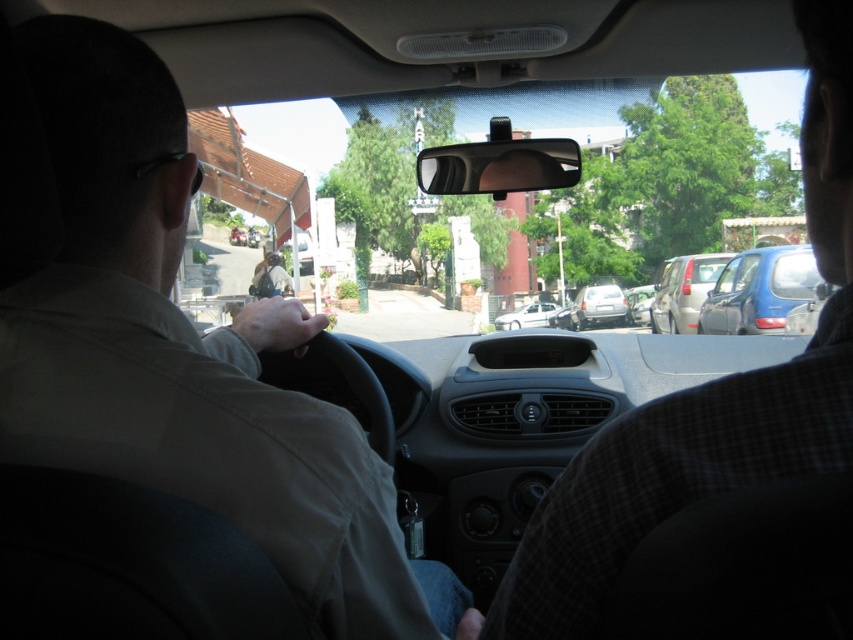
Question: Which point appears closest to the camera in this image?

Choices:
 (A) (799, 278)
 (B) (718, 451)
 (C) (613, 321)

Answer: (B)

Question: Which point is farther to the camera?

Choices:
 (A) silver metallic sedan at right
 (B) checkered fabric shirt at right

Answer: (A)

Question: Which of the following is the farthest from the observer?

Choices:
 (A) (532, 326)
 (B) (604, 308)

Answer: (A)

Question: Can you confirm if checkered fabric shirt at right is positioned to the left of white matte sedan at center?

Choices:
 (A) yes
 (B) no

Answer: (A)

Question: Is light beige shirt at left to the left of satin silver sedan at center from the viewer's perspective?

Choices:
 (A) yes
 (B) no

Answer: (A)

Question: Considering the relative positions of black glossy view mirror at center and white matte sedan at center in the image provided, where is black glossy view mirror at center located with respect to white matte sedan at center?

Choices:
 (A) above
 (B) below

Answer: (A)